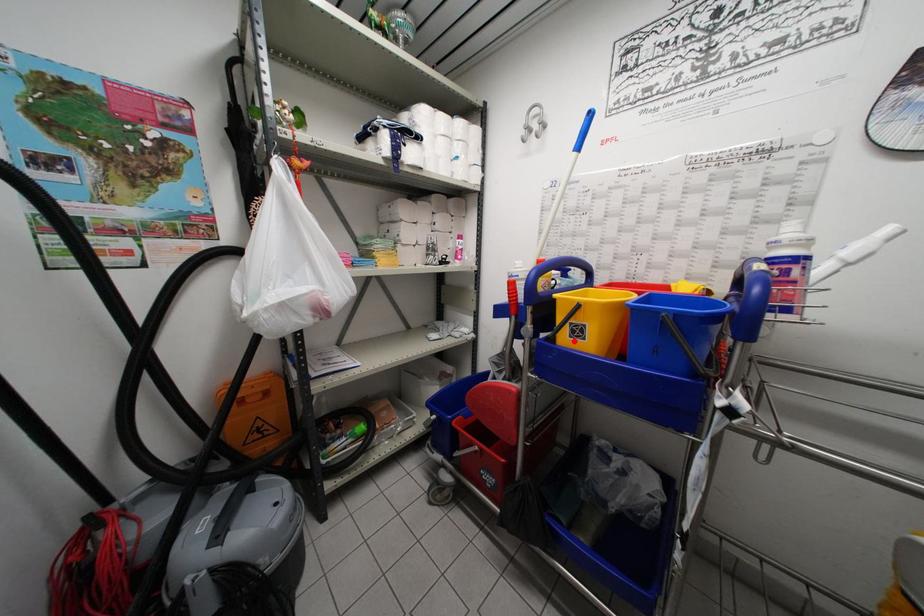
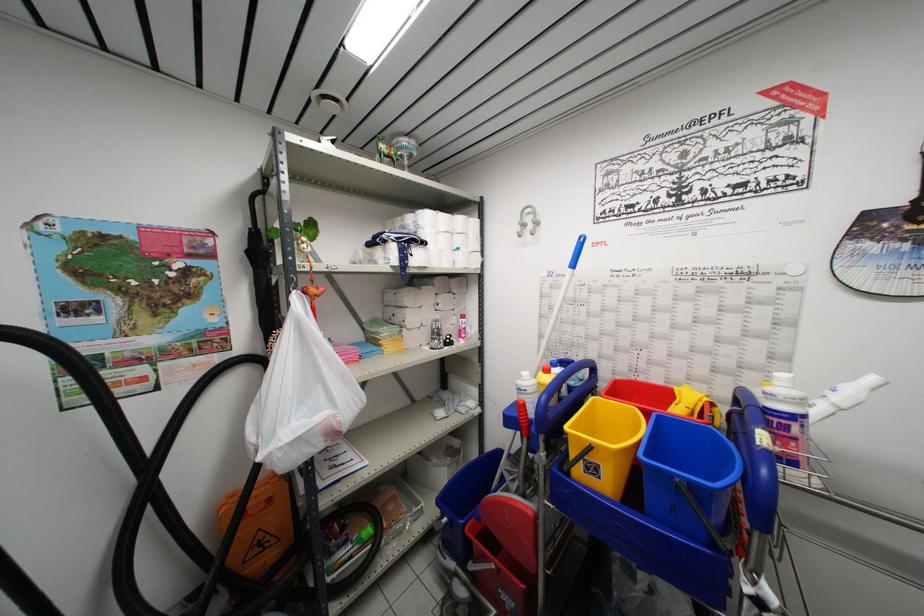
Question: I am providing you with two images of the same scene from different viewpoints. Given a red point in image1, look at the same physical point in image2. Is it:

Choices:
 (A) Closer to the viewpoint
 (B) Farther from the viewpoint

Answer: (A)